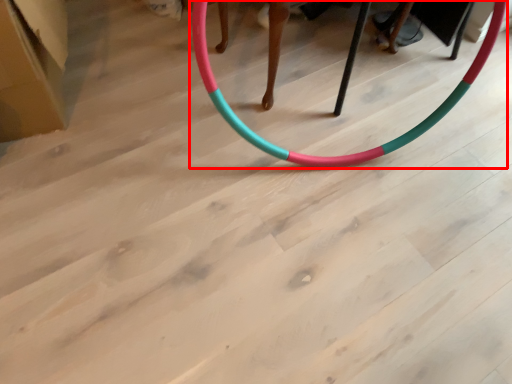
Question: In this image, where is toy (annotated by the red box) located relative to cardboard box?

Choices:
 (A) left
 (B) right

Answer: (B)